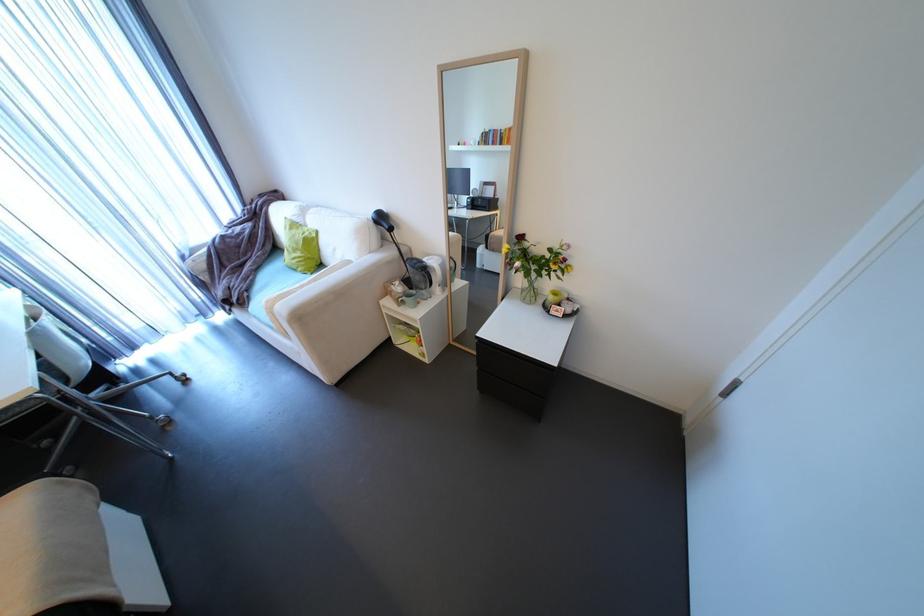
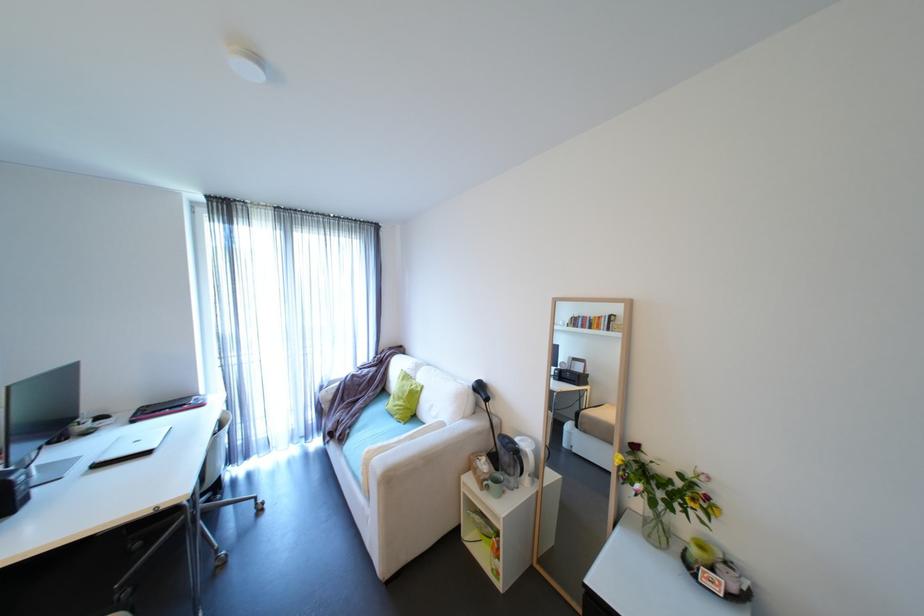
From the picture: The images are taken continuously from a first-person perspective. In which direction is your viewpoint rotating?

The camera rotated toward left-up.